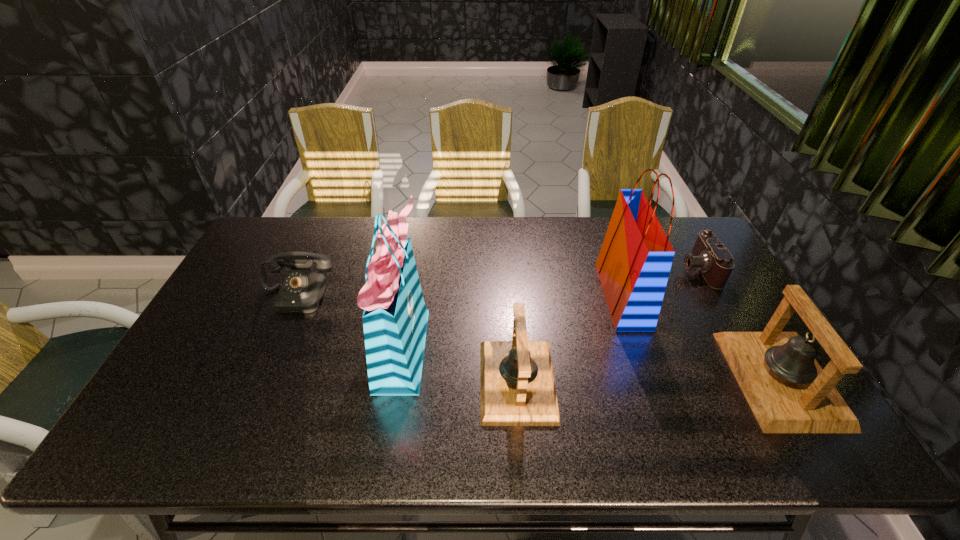
With all bells evenly spaced, where should an extra bell be placed on the left to continue the pattern? Please point out a vacant space. Please provide its 2D coordinates. Your answer should be formatted as a tuple, i.e. [(x, y)], where the tuple contains the x and y coordinates of a point satisfying the conditions above.

[(252, 383)]